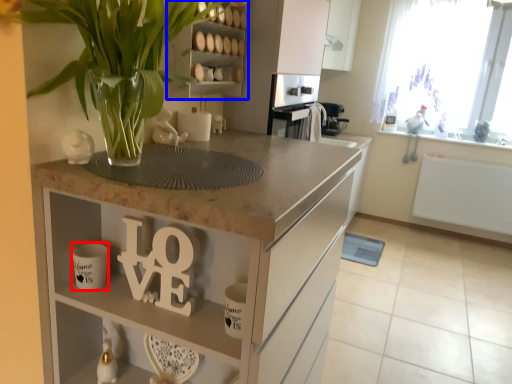
Question: Which object is further to the camera taking this photo, mug (highlighted by a red box) or cabinet (highlighted by a blue box)?

Choices:
 (A) mug
 (B) cabinet

Answer: (B)